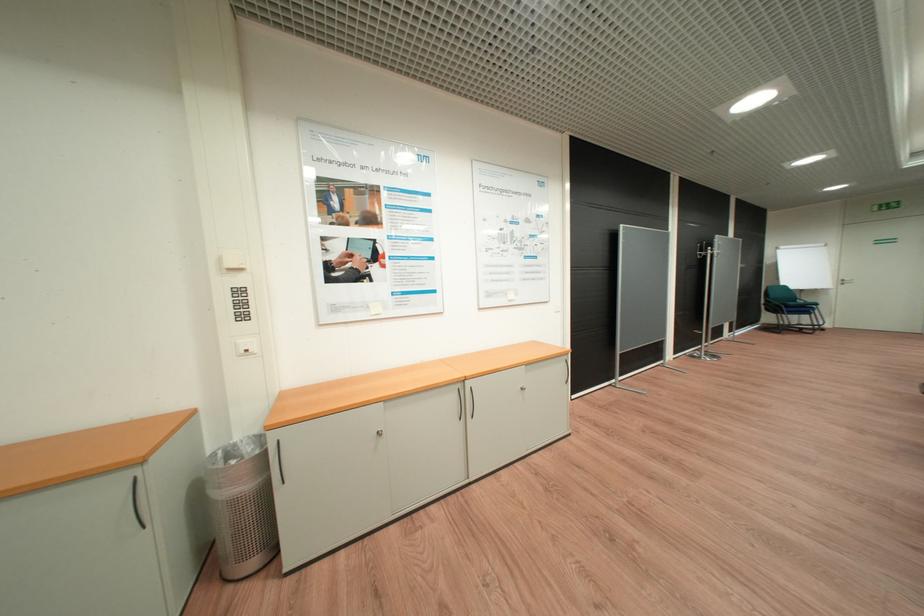
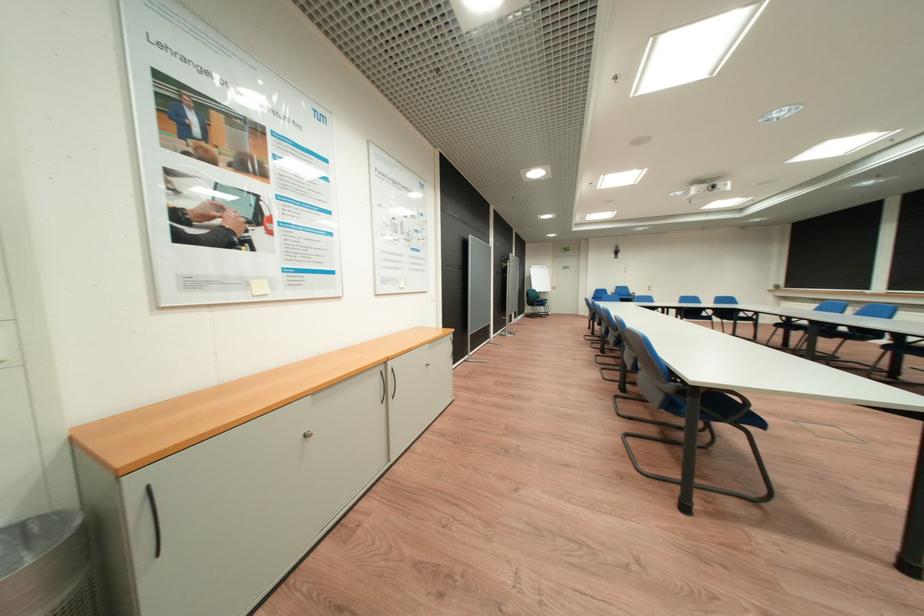
Question: The camera is either moving clockwise (left) or counter-clockwise (right) around the object. The first image is from the beginning of the video and the second image is from the end. Is the camera moving left or right when shooting the video?

Choices:
 (A) Left
 (B) Right

Answer: (A)